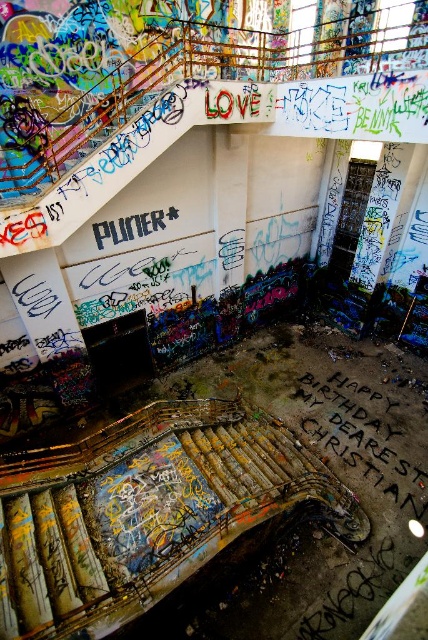
Does rusty metal stairs at center come behind black chalk writing at center?

No, rusty metal stairs at center is closer to the viewer.

Between rusty metal stairs at center and black chalk writing at center, which one is positioned lower?

black chalk writing at center is below.

Which is in front, point (51, 474) or point (327, 410)?

Point (51, 474)

Find the location of a particular element. The image size is (428, 640). rusty metal stairs at center is located at coordinates (146, 509).